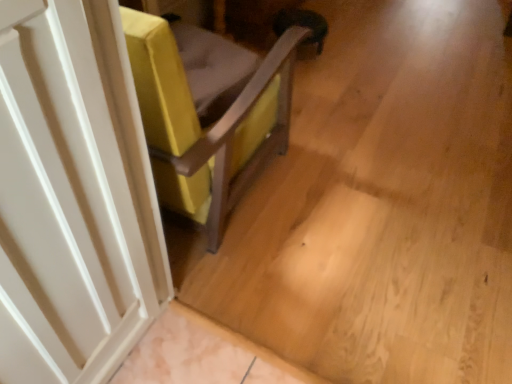
Question: From the image's perspective, is white matte door at left located above or below velvet yellow chair at center?

Choices:
 (A) below
 (B) above

Answer: (A)

Question: In the image, is white matte door at left on the left side or the right side of velvet yellow chair at center?

Choices:
 (A) right
 (B) left

Answer: (B)

Question: Looking at the image, does white matte door at left seem bigger or smaller compared to velvet yellow chair at center?

Choices:
 (A) big
 (B) small

Answer: (B)

Question: Do you think velvet yellow chair at center is within white matte door at left, or outside of it?

Choices:
 (A) inside
 (B) outside

Answer: (B)

Question: Is point (206, 178) closer or farther from the camera than point (83, 306)?

Choices:
 (A) farther
 (B) closer

Answer: (A)

Question: From their relative heights in the image, would you say velvet yellow chair at center is taller or shorter than white matte door at left?

Choices:
 (A) short
 (B) tall

Answer: (A)

Question: Based on their positions, is velvet yellow chair at center located to the left or right of white matte door at left?

Choices:
 (A) right
 (B) left

Answer: (A)